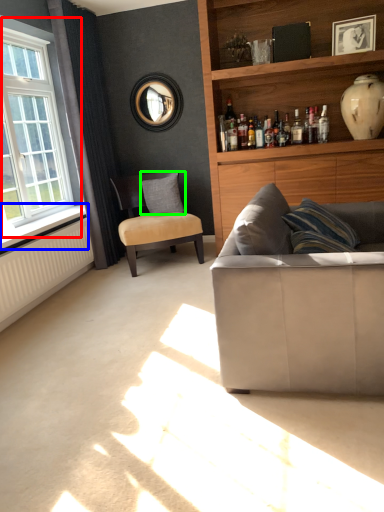
Question: Based on their relative distances, which object is farther from window (highlighted by a red box)? Choose from window sill (highlighted by a blue box) and pillow (highlighted by a green box).

Choices:
 (A) window sill
 (B) pillow

Answer: (B)